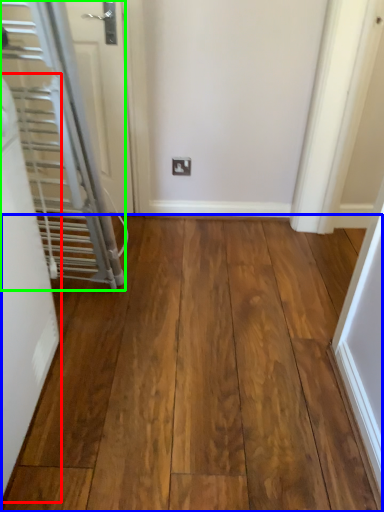
Question: Estimate the real-world distances between objects in this image. Which object is farther from door (highlighted by a red box), hardwood (highlighted by a blue box) or door (highlighted by a green box)?

Choices:
 (A) hardwood
 (B) door

Answer: (A)